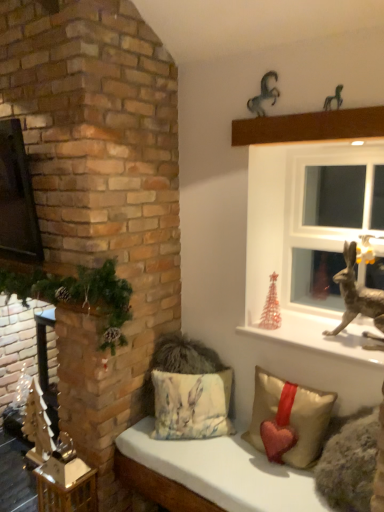
What do you see at coordinates (78, 294) in the screenshot? I see `green matte garland at left, the 1th christmas decoration in the front-to-back sequence` at bounding box center [78, 294].

At what (x,y) coordinates should I click in order to perform the action: click on metallic silver horse at upper center, the first animal in the left-to-right sequence. Please return your answer as a coordinate pair (x, y). The width and height of the screenshot is (384, 512). Looking at the image, I should click on [264, 95].

Locate an element on the screen. This screenshot has height=512, width=384. metallic horse at upper right, which is the 1th animal in front-to-back order is located at coordinates 334,98.

Image resolution: width=384 pixels, height=512 pixels. In order to click on beige fabric pillow with heart at lower center, the 1th pillow in the right-to-left sequence in this screenshot , I will do `click(290, 417)`.

Identify the location of green matte garland at left, which is counted as the second christmas decoration, starting from the back. (78, 294).

Between metallic horse at upper right, the second animal from the back, and beige fabric pillow with heart at lower center, the 2th pillow viewed from the left, which one appears on the left side from the viewer's perspective?

Positioned to the left is beige fabric pillow with heart at lower center, the 2th pillow viewed from the left.

From the image's perspective, does metallic horse at upper right, the second animal when ordered from left to right, appear higher than beige fabric pillow with heart at lower center, the 1th pillow in the right-to-left sequence?

Correct, metallic horse at upper right, the second animal when ordered from left to right, appears higher than beige fabric pillow with heart at lower center, the 1th pillow in the right-to-left sequence, in the image.

Is metallic horse at upper right, the second animal from the back, directly adjacent to beige fabric pillow with heart at lower center, the 2th pillow viewed from the left?

No, metallic horse at upper right, the second animal from the back, is not touching beige fabric pillow with heart at lower center, the 2th pillow viewed from the left.

Which of these two, metallic horse at upper right, the second animal when ordered from left to right, or beige fabric pillow with heart at lower center, the 2th pillow viewed from the left, stands shorter?

metallic horse at upper right, the second animal when ordered from left to right.

Which pillow is the 2nd one when counting from the left side of the metallic gold statue at upper right? Please provide its 2D coordinates.

[(191, 405)]

Is metallic gold statue at upper right positioned beyond the bounds of fluffy beige cushion with rabbit print at lower center, the first pillow viewed from the left?

Yes.

From a real-world perspective, is metallic gold statue at upper right beneath fluffy beige cushion with rabbit print at lower center, the 2th pillow positioned from the right?

No, from a real-world perspective, metallic gold statue at upper right is not below fluffy beige cushion with rabbit print at lower center, the 2th pillow positioned from the right.

From the image's perspective, who appears lower, metallic gold statue at upper right or fluffy beige cushion with rabbit print at lower center, the first pillow viewed from the left?

fluffy beige cushion with rabbit print at lower center, the first pillow viewed from the left, is shown below in the image.

Looking at this image, is beige fabric pillow with heart at lower center, the 2th pillow viewed from the left, not near fluffy fabric cushion at lower center?

No.

Does beige fabric pillow with heart at lower center, the 1th pillow in the right-to-left sequence, contain fluffy fabric cushion at lower center?

That's incorrect, fluffy fabric cushion at lower center is not inside beige fabric pillow with heart at lower center, the 1th pillow in the right-to-left sequence.

Based on the photo, considering the sizes of objects beige fabric pillow with heart at lower center, the 1th pillow in the right-to-left sequence, and fluffy fabric cushion at lower center in the image provided, who is shorter, beige fabric pillow with heart at lower center, the 1th pillow in the right-to-left sequence, or fluffy fabric cushion at lower center?

With less height is beige fabric pillow with heart at lower center, the 1th pillow in the right-to-left sequence.

Between beige fabric pillow with heart at lower center, the 1th pillow in the right-to-left sequence, and fluffy fabric cushion at lower center, which one has larger width?

With larger width is fluffy fabric cushion at lower center.

What's the angular difference between metallic brown ledge at upper center and green matte garland at left, the 1th christmas decoration in the front-to-back sequence,'s facing directions?

There is a 0.347-degree angle between the facing directions of metallic brown ledge at upper center and green matte garland at left, the 1th christmas decoration in the front-to-back sequence.

Considering the relative sizes of metallic brown ledge at upper center and green matte garland at left, which is counted as the second christmas decoration, starting from the back, in the image provided, is metallic brown ledge at upper center thinner than green matte garland at left, which is counted as the second christmas decoration, starting from the back,?

Indeed, metallic brown ledge at upper center has a lesser width compared to green matte garland at left, which is counted as the second christmas decoration, starting from the back.

Is metallic brown ledge at upper center looking in the opposite direction of green matte garland at left, positioned as the first christmas decoration in left-to-right order?

metallic brown ledge at upper center is not turned away from green matte garland at left, positioned as the first christmas decoration in left-to-right order.

From the image's perspective, which is above, metallic brown ledge at upper center or green matte garland at left, positioned as the first christmas decoration in left-to-right order?

metallic brown ledge at upper center.

From the image's perspective, which is above, beige fabric pillow with heart at lower center, the 1th pillow in the right-to-left sequence, or metallic gold statue at upper right?

metallic gold statue at upper right appears higher in the image.

From the picture: Which point is more distant from viewer, [289,400] or [359,322]?

The point [359,322] is farther from the camera.

From a real-world perspective, is beige fabric pillow with heart at lower center, the 2th pillow viewed from the left, on top of metallic gold statue at upper right?

No, from a real-world perspective, beige fabric pillow with heart at lower center, the 2th pillow viewed from the left, is not on top of metallic gold statue at upper right.

Is beige fabric pillow with heart at lower center, the 2th pillow viewed from the left, to the right of metallic gold statue at upper right from the viewer's perspective?

Incorrect, beige fabric pillow with heart at lower center, the 2th pillow viewed from the left, is not on the right side of metallic gold statue at upper right.

From a real-world perspective, is metallic gold statue at upper right above or below metallic horse at upper right, the second animal from the back?

metallic gold statue at upper right is situated lower than metallic horse at upper right, the second animal from the back, in the real world.

Considering the relative sizes of metallic gold statue at upper right and metallic horse at upper right, the second animal from the back, in the image provided, is metallic gold statue at upper right smaller than metallic horse at upper right, the second animal from the back,?

No, metallic gold statue at upper right is not smaller than metallic horse at upper right, the second animal from the back.

Is metallic horse at upper right, which is the 1th animal in front-to-back order, inside metallic gold statue at upper right?

No, metallic horse at upper right, which is the 1th animal in front-to-back order, is not a part of metallic gold statue at upper right.

Is point (349, 355) positioned behind point (335, 89)?

Yes, it is.

Considering the sizes of translucent glass christmas tree at right, the 2th christmas decoration positioned from the front, and white plastic window at upper right in the image, is translucent glass christmas tree at right, the 2th christmas decoration positioned from the front, wider or thinner than white plastic window at upper right?

Considering their sizes, translucent glass christmas tree at right, the 2th christmas decoration positioned from the front, looks broader than white plastic window at upper right.

Is translucent glass christmas tree at right, the 2th christmas decoration positioned from the front, directly adjacent to white plastic window at upper right?

No.

Is translucent glass christmas tree at right, which ranks as the first christmas decoration in right-to-left order, smaller than white plastic window at upper right?

Yes, translucent glass christmas tree at right, which ranks as the first christmas decoration in right-to-left order, is smaller than white plastic window at upper right.

Is translucent glass christmas tree at right, which ranks as the first christmas decoration in right-to-left order, positioned beyond the bounds of white plastic window at upper right?

Yes, translucent glass christmas tree at right, which ranks as the first christmas decoration in right-to-left order, is not within white plastic window at upper right.

Where is `animal that is the 1st one when counting upward from the beige fabric pillow with heart at lower center, the 2th pillow viewed from the left (from the image's perspective)`? The width and height of the screenshot is (384, 512). animal that is the 1st one when counting upward from the beige fabric pillow with heart at lower center, the 2th pillow viewed from the left (from the image's perspective) is located at coordinates (334, 98).

Where is `window sill located in front of the fluffy beige cushion with rabbit print at lower center, the 2th pillow positioned from the right`? This screenshot has height=512, width=384. window sill located in front of the fluffy beige cushion with rabbit print at lower center, the 2th pillow positioned from the right is located at coordinates (321, 335).

Based on their spatial positions, is metallic brown ledge at upper center or white plastic window at upper right closer to green matte garland at left, positioned as the second christmas decoration in right-to-left order?

Among the two, metallic brown ledge at upper center is located nearer to green matte garland at left, positioned as the second christmas decoration in right-to-left order.

Considering their positions, is fluffy beige cushion with rabbit print at lower center, the first pillow viewed from the left, positioned closer to translucent glass christmas tree at right, the 2th christmas decoration positioned from the front, than metallic horse at upper right, the second animal from the back?

The object closer to translucent glass christmas tree at right, the 2th christmas decoration positioned from the front, is fluffy beige cushion with rabbit print at lower center, the first pillow viewed from the left.

Consider the image. When comparing their distances from fluffy beige cushion with rabbit print at lower center, the first pillow viewed from the left, does shiny metallic reindeer at right or translucent glass christmas tree at right, which is the first christmas decoration from back to front, seem closer?

translucent glass christmas tree at right, which is the first christmas decoration from back to front, is closer to fluffy beige cushion with rabbit print at lower center, the first pillow viewed from the left.

When comparing their distances from translucent glass christmas tree at right, which is the first christmas decoration from back to front, does metallic horse at upper right, which is the 1th animal in front-to-back order, or shiny metallic reindeer at right seem further?

Based on the image, metallic horse at upper right, which is the 1th animal in front-to-back order, appears to be further to translucent glass christmas tree at right, which is the first christmas decoration from back to front.

Looking at the image, which one is located closer to fluffy beige cushion with rabbit print at lower center, the 2th pillow positioned from the right, metallic silver horse at upper center, which is the 2th animal in front-to-back order, or metallic gold statue at upper right?

Based on the image, metallic gold statue at upper right appears to be nearer to fluffy beige cushion with rabbit print at lower center, the 2th pillow positioned from the right.

Considering their positions, is metallic horse at upper right, the second animal from the back, positioned closer to beige fabric pillow with heart at lower center, the 2th pillow viewed from the left, than metallic silver horse at upper center, the second animal when ordered from right to left?

metallic horse at upper right, the second animal from the back, lies closer to beige fabric pillow with heart at lower center, the 2th pillow viewed from the left, than the other object.

Looking at the image, which one is located further to beige fabric pillow with heart at lower center, the 2th pillow viewed from the left, metallic brown ledge at upper center or metallic gold statue at upper right?

The object further to beige fabric pillow with heart at lower center, the 2th pillow viewed from the left, is metallic brown ledge at upper center.

Looking at this image, from the image, which object appears to be farther from white plastic window at upper right, metallic brown ledge at upper center or metallic silver horse at upper center, the second animal when ordered from right to left?

metallic silver horse at upper center, the second animal when ordered from right to left.

Identify the location of ledge between metallic silver horse at upper center, the first animal in the left-to-right sequence, and fluffy beige cushion with rabbit print at lower center, the first pillow viewed from the left, in the vertical direction. (310, 126).

At what (x,y) coordinates should I click in order to perform the action: click on ledge that lies between metallic silver horse at upper center, which is the 2th animal in front-to-back order, and shiny metallic reindeer at right from top to bottom. Please return your answer as a coordinate pair (x, y). Looking at the image, I should click on (310, 126).

The image size is (384, 512). Identify the location of window sill between metallic horse at upper right, the second animal from the back, and beige fabric pillow with heart at lower center, the 1th pillow in the right-to-left sequence, vertically. (321, 335).

The height and width of the screenshot is (512, 384). I want to click on window between metallic brown ledge at upper center and metallic gold statue at upper right vertically, so click(327, 217).